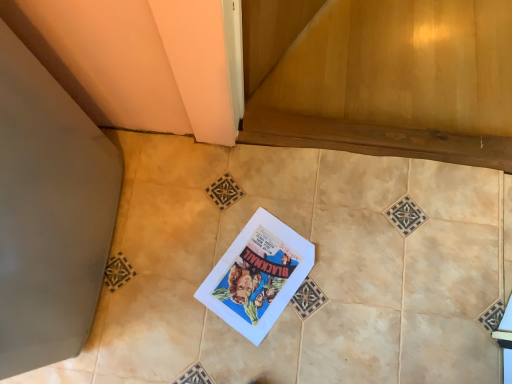
Where is `vacant area situated below matte paper comic book at center (from a real-world perspective)`? vacant area situated below matte paper comic book at center (from a real-world perspective) is located at coordinates (260, 277).